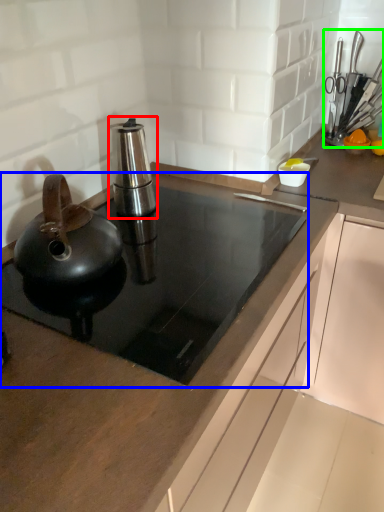
Question: Which object is positioned farthest from kitchen appliance (highlighted by a red box)? Select from gas stove (highlighted by a blue box) and appliance (highlighted by a green box).

Choices:
 (A) gas stove
 (B) appliance

Answer: (B)